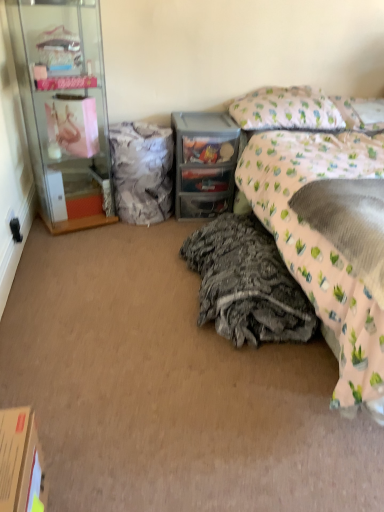
Locate an element on the screen. The height and width of the screenshot is (512, 384). vacant space that's between cardboard box at lower left and textured gray blanket at lower center, placed as the first material when sorted from front to back is located at coordinates (154, 380).